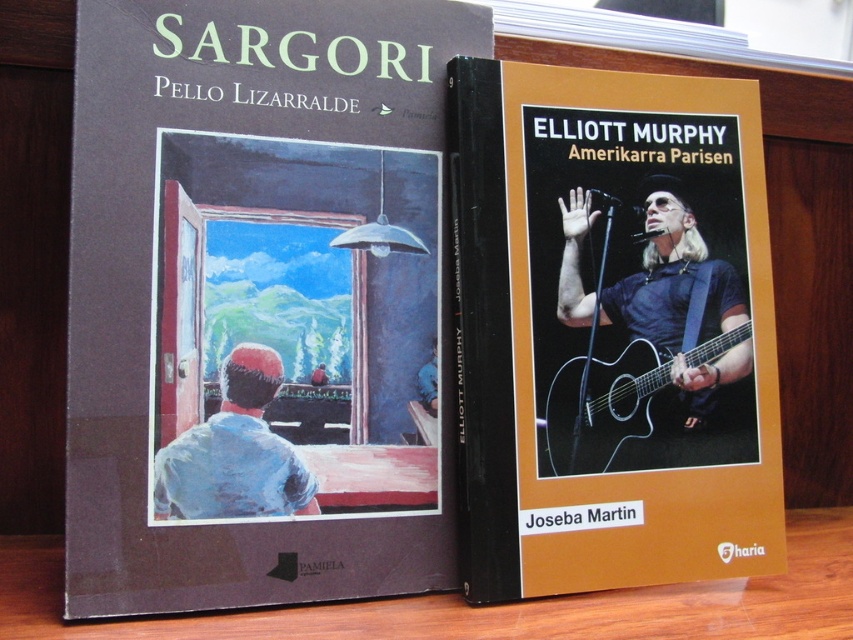
Does matte brown book cover at left have a lesser width compared to acoustic wood guitar at center?

No, matte brown book cover at left is not thinner than acoustic wood guitar at center.

The width and height of the screenshot is (853, 640). Describe the element at coordinates (254, 301) in the screenshot. I see `matte brown book cover at left` at that location.

Does point (285, 518) come farther from viewer compared to point (653, 355)?

No, it is in front of (653, 355).

The width and height of the screenshot is (853, 640). Identify the location of matte brown book cover at left. (254, 301).

Can you confirm if matte brown book cover at left is shorter than matte black guitar at center?

No.

Is point (80, 374) farther from viewer compared to point (544, 140)?

No, (80, 374) is in front of (544, 140).

This screenshot has width=853, height=640. Describe the element at coordinates (254, 301) in the screenshot. I see `matte brown book cover at left` at that location.

This screenshot has height=640, width=853. What are the coordinates of `matte brown book cover at left` in the screenshot? It's located at (254, 301).

Who is positioned more to the right, matte black guitar at center or acoustic wood guitar at center?

Positioned to the right is acoustic wood guitar at center.

The image size is (853, 640). Find the location of `matte black guitar at center`. matte black guitar at center is located at coordinates (611, 330).

What do you see at coordinates (611, 330) in the screenshot?
I see `matte black guitar at center` at bounding box center [611, 330].

I want to click on matte black guitar at center, so click(611, 330).